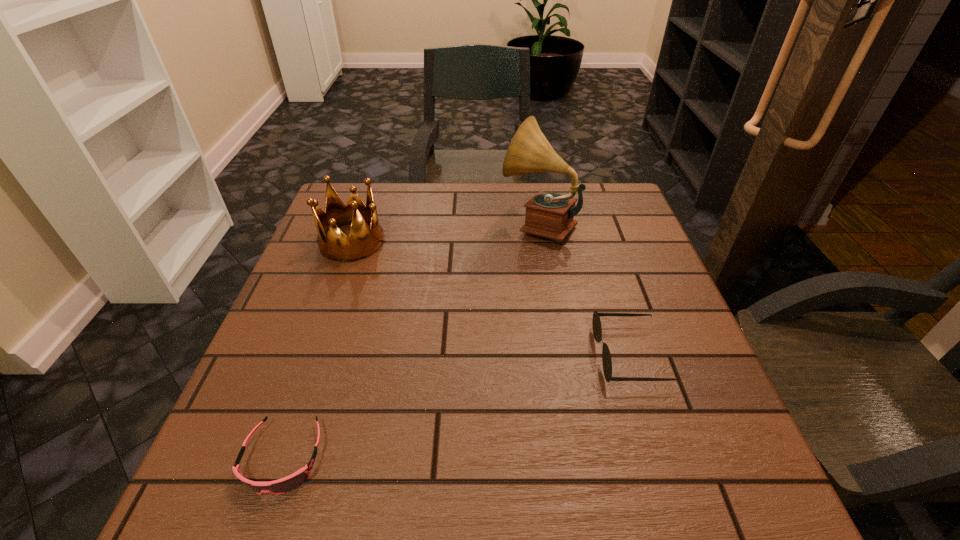
The width and height of the screenshot is (960, 540). I want to click on blank space that satisfies the following two spatial constraints: 1. on the front-facing side of the second nearest object; 2. on the front-facing side of the nearest object, so click(x=661, y=458).

Where is `free space in the image that satisfies the following two spatial constraints: 1. on the horn of the phonograph record; 2. on the front-facing side of the goggles`? free space in the image that satisfies the following two spatial constraints: 1. on the horn of the phonograph record; 2. on the front-facing side of the goggles is located at coordinates (578, 458).

This screenshot has height=540, width=960. I want to click on free location that satisfies the following two spatial constraints: 1. on the front-facing side of the second nearest object; 2. on the front-facing side of the nearest object, so click(661, 458).